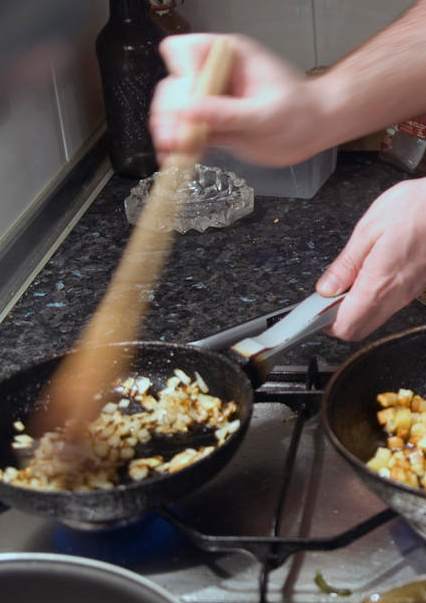
Where is `white tiled wall`? The image size is (426, 603). white tiled wall is located at coordinates (35, 119), (77, 55), (286, 17), (353, 20).